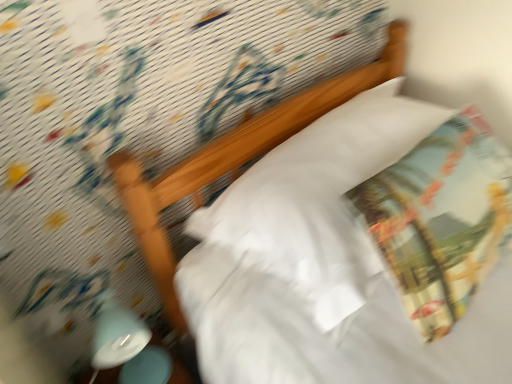
Question: From the image's perspective, relative to white glossy bedside lamp at lower left, is printed fabric throw pillow at upper right above or below?

Choices:
 (A) below
 (B) above

Answer: (B)

Question: Is point (482, 178) positioned closer to the camera than point (117, 329)?

Choices:
 (A) farther
 (B) closer

Answer: (B)

Question: Which of these objects is positioned closest to the white glossy bedside lamp at lower left?

Choices:
 (A) printed fabric throw pillow at upper right
 (B) white soft pillow at center

Answer: (B)

Question: Based on their relative distances, which object is farther from the white glossy bedside lamp at lower left?

Choices:
 (A) white soft pillow at center
 (B) printed fabric throw pillow at upper right

Answer: (B)